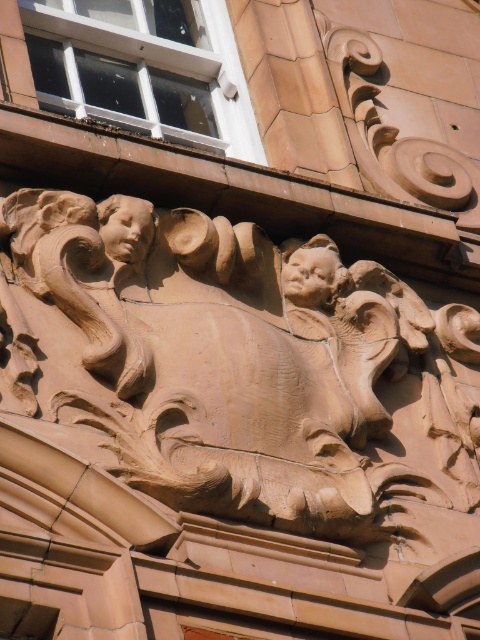
Does matte brown head at center appear over matte stone face at upper left?

No, matte brown head at center is not above matte stone face at upper left.

Which is in front, point (337, 259) or point (139, 262)?

Point (139, 262) is in front.

The image size is (480, 640). What do you see at coordinates (312, 273) in the screenshot?
I see `matte brown head at center` at bounding box center [312, 273].

Find the location of `matte brown head at center`. matte brown head at center is located at coordinates (312, 273).

This screenshot has width=480, height=640. Describe the element at coordinates (144, 68) in the screenshot. I see `matte glass window at upper left` at that location.

Is the position of matte glass window at upper left more distant than that of matte brown head at center?

Yes, matte glass window at upper left is behind matte brown head at center.

Where is `matte glass window at upper left`? The width and height of the screenshot is (480, 640). matte glass window at upper left is located at coordinates (144, 68).

Can you confirm if brown stone sculpture at center is positioned to the right of matte glass window at upper left?

Indeed, brown stone sculpture at center is positioned on the right side of matte glass window at upper left.

Who is positioned more to the left, brown stone sculpture at center or matte glass window at upper left?

matte glass window at upper left is more to the left.

Based on the photo, who is more distant from viewer, (x=82, y=337) or (x=63, y=65)?

The point (x=63, y=65) is more distant.

You are a GUI agent. You are given a task and a screenshot of the screen. Output one action in this format:
    pyautogui.click(x=<x>, y=<y>)
    Task: Click on the brown stone sculpture at center
    
    Given the screenshot: What is the action you would take?
    pyautogui.click(x=244, y=380)